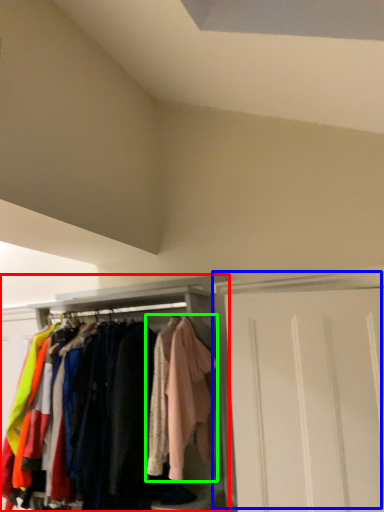
Question: Which object is positioned closest to cabinetry (highlighted by a red box)? Select from door (highlighted by a blue box) and clothing (highlighted by a green box).

Choices:
 (A) door
 (B) clothing

Answer: (B)